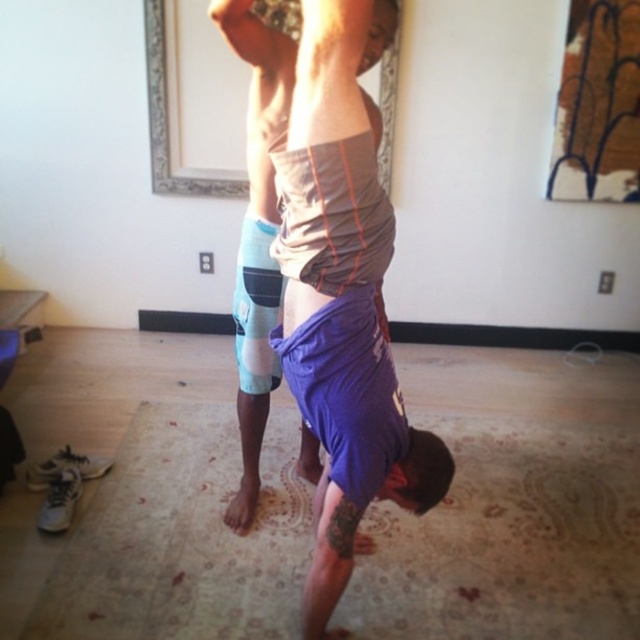
Is purple cotton shorts at center closer to camera compared to gray matte tank top at center?

That is True.

Does purple cotton shorts at center have a larger size compared to gray matte tank top at center?

Correct, purple cotton shorts at center is larger in size than gray matte tank top at center.

Who is more distant from viewer, (308, 35) or (237, 292)?

Point (237, 292)

The image size is (640, 640). In order to click on purple cotton shorts at center in this screenshot , I will do `click(342, 305)`.

Which is in front, point (589, 612) or point (332, 24)?

Point (332, 24) is in front.

Can you confirm if purple fabric mat at lower center is taller than purple cotton shorts at center?

In fact, purple fabric mat at lower center may be shorter than purple cotton shorts at center.

Where is `purple fabric mat at lower center`? The height and width of the screenshot is (640, 640). purple fabric mat at lower center is located at coordinates (509, 538).

Who is higher up, purple fabric mat at lower center or gray matte tank top at center?

Positioned higher is gray matte tank top at center.

Who is more forward, (500,452) or (378,56)?

Point (378,56)

Is point (307, 531) farther from camera compared to point (304, 440)?

No, it is in front of (304, 440).

This screenshot has height=640, width=640. I want to click on purple fabric mat at lower center, so click(509, 538).